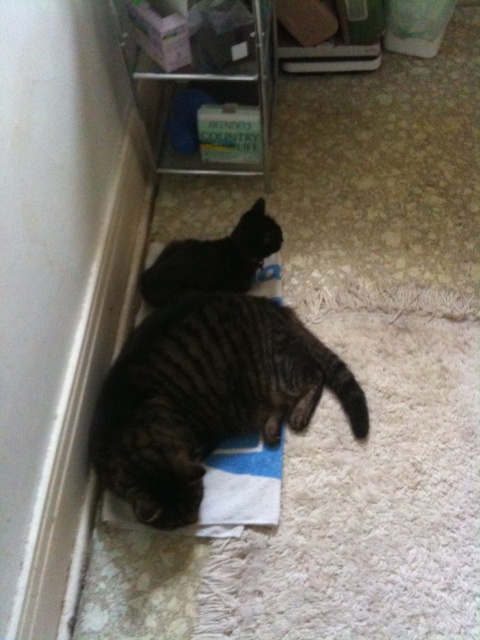
You are a cat owner who wants to place a new cat bed on the floor. The bed is 1.2 meters wide. You see the striped fur cat at lower left and the black fur cat at center. Which cat is bigger and can the bed fit between them?

The striped fur cat at lower left is larger than the black fur cat at center. The bed may fit between them if the distance between the two cats is at least 1.2 meters, but the exact spacing isn not provided in the scene description.

You are a photographer aiming to capture both the striped fur cat at lower left and the black fur cat at center in a single frame. Based on their positions, which cat should you adjust your camera angle to focus on first to ensure both are in the shot?

The striped fur cat at lower left is to the left of the black fur cat at center, so you should focus on the black fur cat at center first to ensure both are captured in the frame.